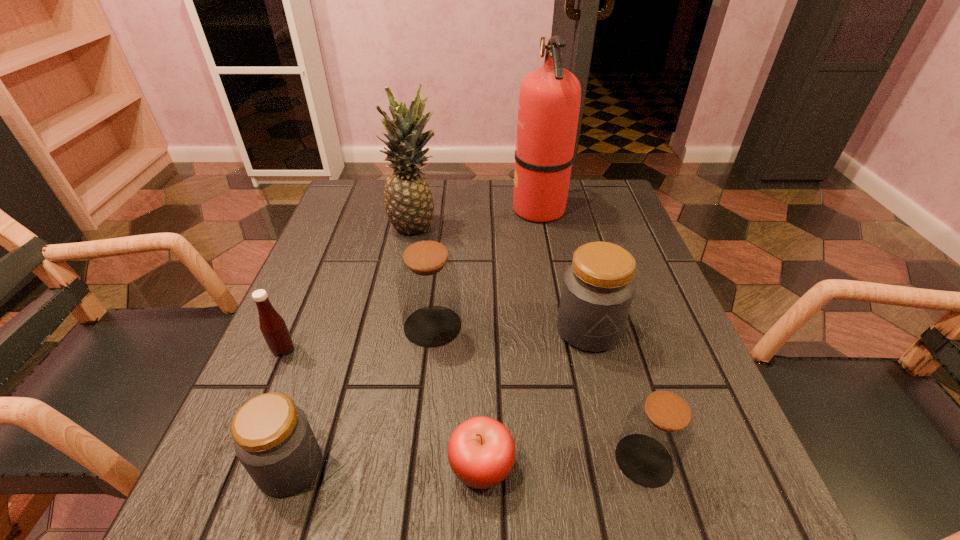
I want to click on the closest object to the second tallest object, so click(x=549, y=102).

The width and height of the screenshot is (960, 540). In order to click on jar that is the second nearest to the right brown jar in this screenshot , I will do `click(428, 283)`.

Identify which jar is the closest to the bigger brown jar. Please provide its 2D coordinates. Your answer should be formatted as a tuple, i.e. [(x, y)], where the tuple contains the x and y coordinates of a point satisfying the conditions above.

[(598, 288)]

You are a GUI agent. You are given a task and a screenshot of the screen. Output one action in this format:
    pyautogui.click(x=<x>, y=<y>)
    Task: Click on the blank area in the image that satisfies the following two spatial constraints: 1. on the surface of the farther gray jar near the warning symbol; 2. on the surface of the seventh object from right to left near the warning symbol
    
    Given the screenshot: What is the action you would take?
    pyautogui.click(x=623, y=467)